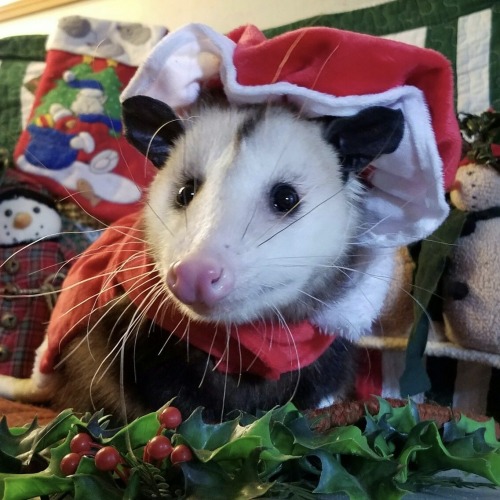
Where is `christmas stocking`? christmas stocking is located at coordinates (77, 98).